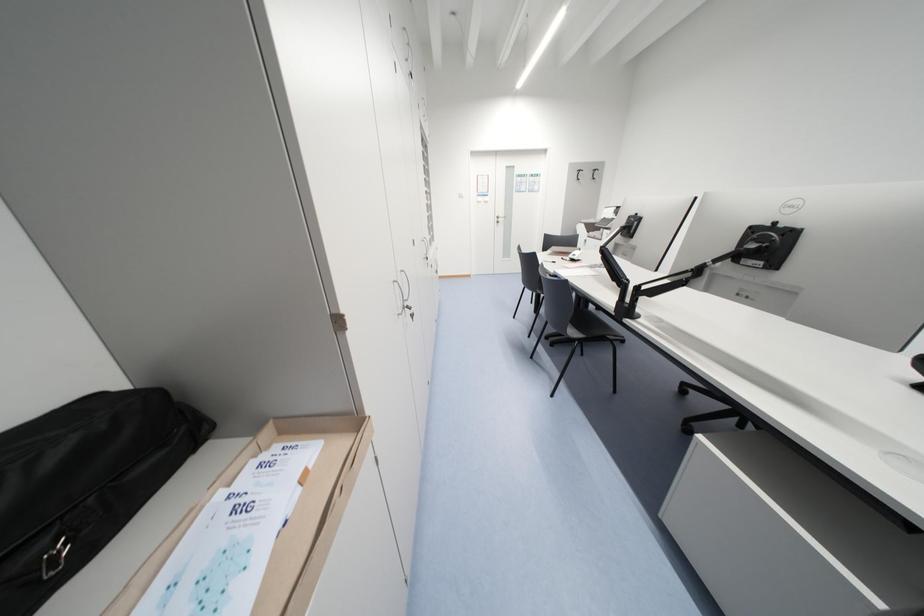
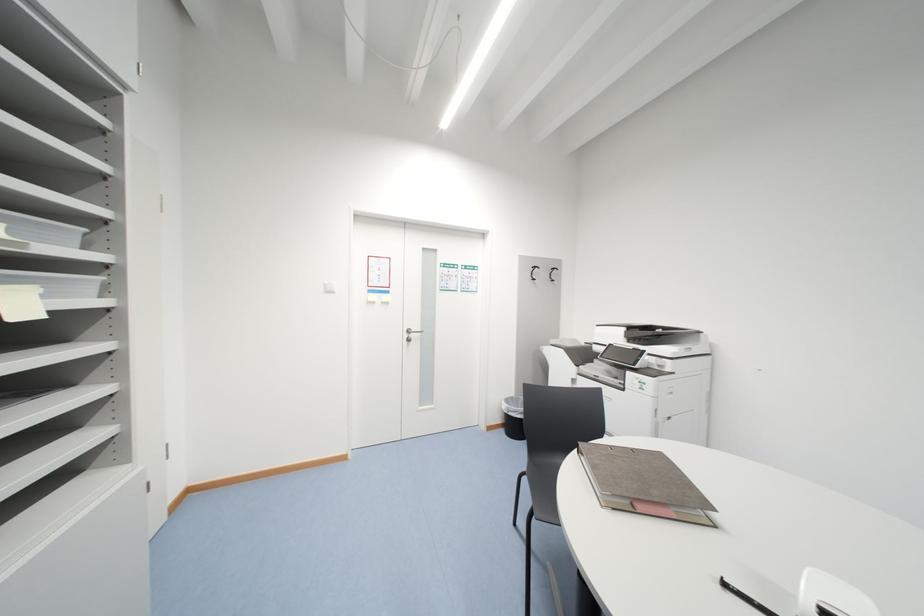
Question: What movement of the cameraman would produce the second image?

Choices:
 (A) Left
 (B) Right
 (C) Forward
 (D) Backward

Answer: (C)